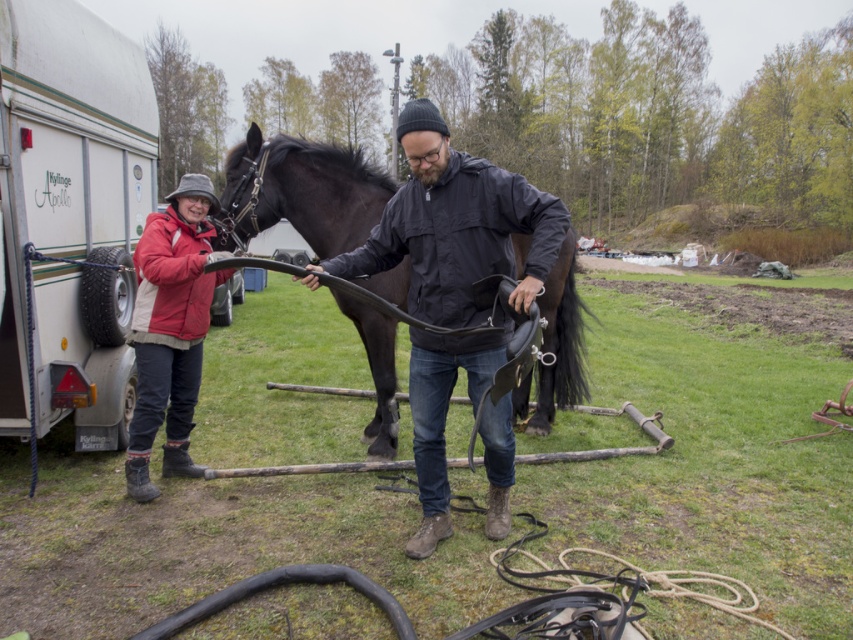
Question: Can you confirm if white plastic trailer at left is positioned to the left of red woolen jacket at left?

Choices:
 (A) no
 (B) yes

Answer: (B)

Question: Which object appears farthest from the camera in this image?

Choices:
 (A) white plastic trailer at left
 (B) shiny black horse at center
 (C) red woolen jacket at left

Answer: (C)

Question: Is shiny black horse at center wider than red woolen jacket at left?

Choices:
 (A) yes
 (B) no

Answer: (A)

Question: Which is nearer to the red woolen jacket at left?

Choices:
 (A) white plastic trailer at left
 (B) shiny black horse at center

Answer: (A)

Question: Considering the relative positions of white plastic trailer at left and red woolen jacket at left in the image provided, where is white plastic trailer at left located with respect to red woolen jacket at left?

Choices:
 (A) left
 (B) right

Answer: (A)

Question: Which object is farther from the camera taking this photo?

Choices:
 (A) red woolen jacket at left
 (B) shiny black horse at center

Answer: (A)